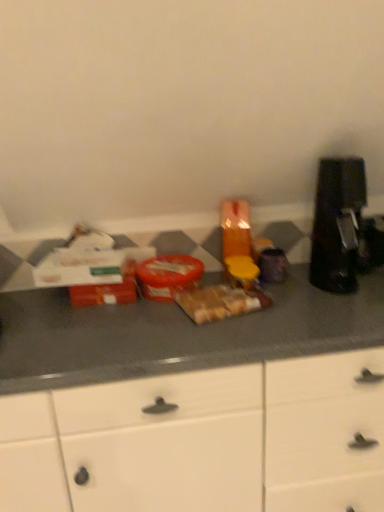
Locate an element on the screen. vacant region to the left of black plastic coffee machine at right is located at coordinates (288, 288).